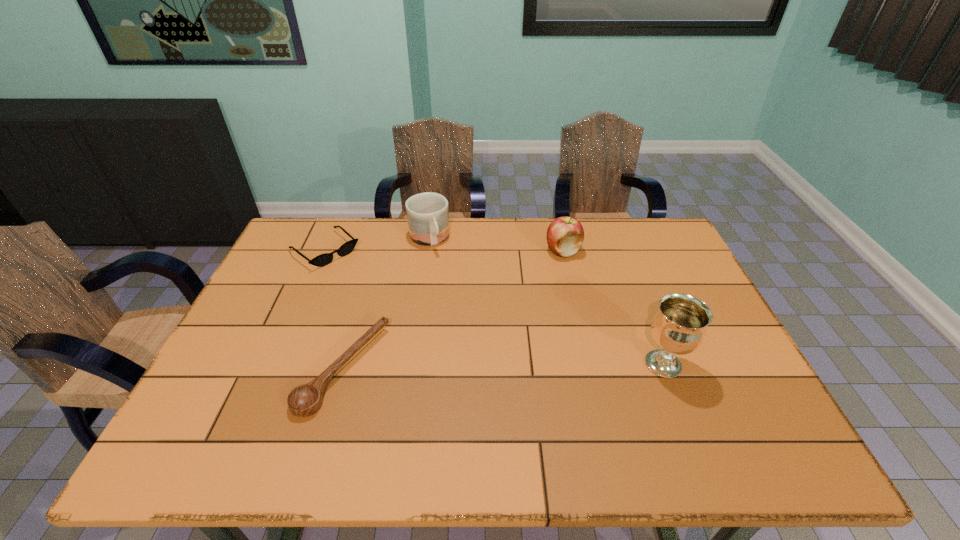
This screenshot has height=540, width=960. I want to click on object that is positioned at the near edge, so click(304, 400).

Locate an element on the screen. This screenshot has width=960, height=540. object present at the left edge is located at coordinates (324, 259).

I want to click on object at the right edge, so click(x=679, y=326).

At what (x,y) coordinates should I click in order to perform the action: click on object present at the far left corner. Please return your answer as a coordinate pair (x, y). This screenshot has height=540, width=960. Looking at the image, I should click on (324, 259).

In order to click on vacant space at the far edge in this screenshot , I will do `click(483, 219)`.

Image resolution: width=960 pixels, height=540 pixels. I want to click on free location at the near edge of the desktop, so click(x=488, y=394).

The height and width of the screenshot is (540, 960). I want to click on blank area at the left edge, so click(x=257, y=381).

Image resolution: width=960 pixels, height=540 pixels. In order to click on vacant space at the far left corner of the desktop in this screenshot , I will do `click(335, 234)`.

At what (x,y) coordinates should I click in order to perform the action: click on free spot between the chalice and the mug. Please return your answer as a coordinate pair (x, y). The image size is (960, 540). Looking at the image, I should click on (546, 302).

Locate an element on the screen. The height and width of the screenshot is (540, 960). empty space between the apple and the wooden spoon is located at coordinates (453, 309).